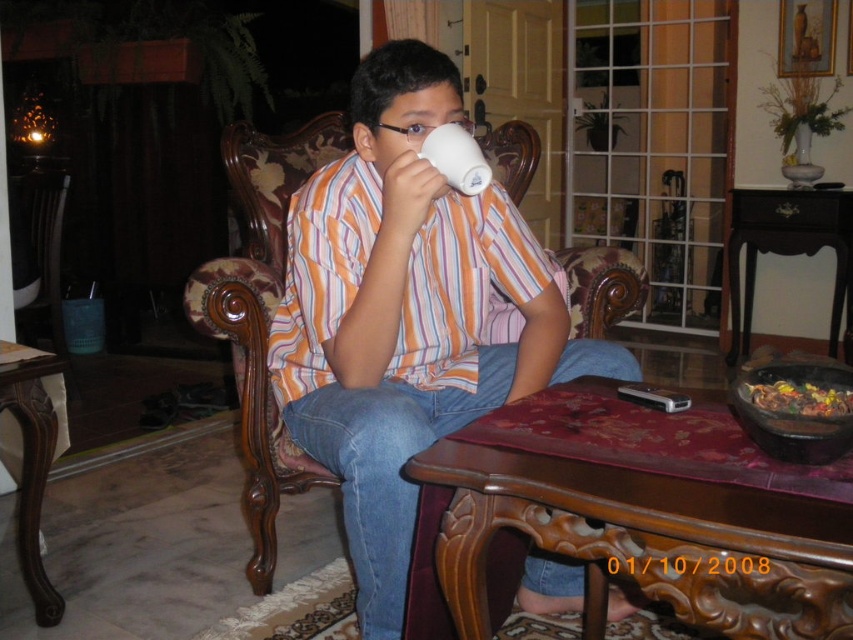
Describe the element at coordinates (408, 314) in the screenshot. I see `matte striped shirt at center` at that location.

Who is more distant from viewer, (354, 401) or (35, 360)?

Positioned behind is point (35, 360).

Image resolution: width=853 pixels, height=640 pixels. I want to click on matte striped shirt at center, so click(408, 314).

Image resolution: width=853 pixels, height=640 pixels. Find the location of `matte striped shirt at center`. matte striped shirt at center is located at coordinates (408, 314).

Can you confirm if brown wood table at lower center is shorter than shiny metallic bowl at lower right?

Incorrect, brown wood table at lower center's height does not fall short of shiny metallic bowl at lower right's.

Between point (704, 518) and point (766, 410), which one is positioned behind?

Point (766, 410)

Is point (712, 484) farther from viewer compared to point (805, 397)?

No.

Where is `brown wood table at lower center`? This screenshot has width=853, height=640. brown wood table at lower center is located at coordinates (630, 536).

Consider the image. Is brown wood table at lower center below black wood table at center?

Yes.

Who is more distant from viewer, (749, 476) or (726, 248)?

The point (726, 248) is more distant.

The height and width of the screenshot is (640, 853). What are the coordinates of `brown wood table at lower center` in the screenshot? It's located at (630, 536).